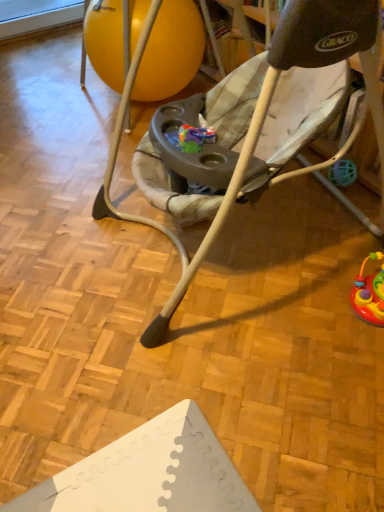
Where is `free point in front of gray fabric baby swing at center`? The image size is (384, 512). free point in front of gray fabric baby swing at center is located at coordinates (225, 398).